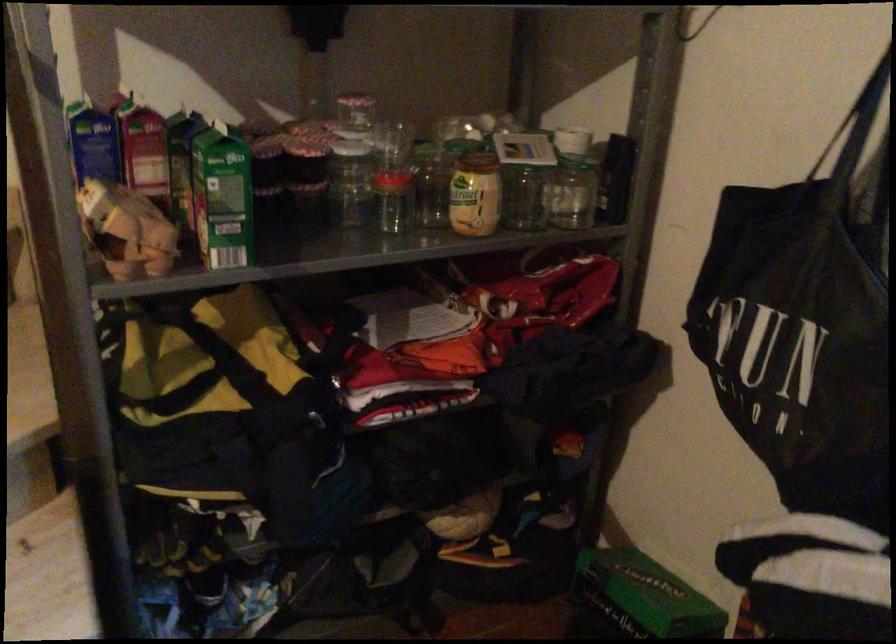
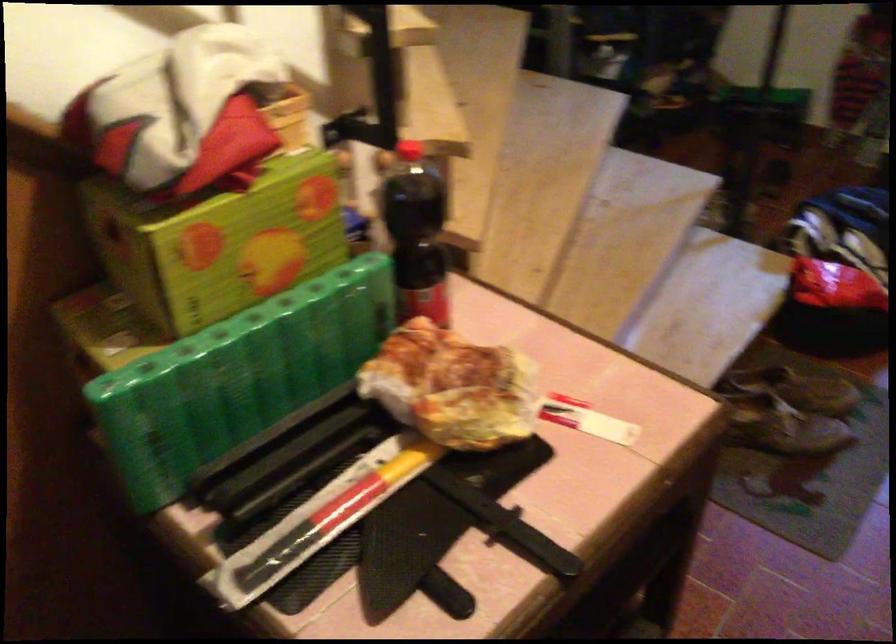
In a continuous first-person perspective shot, in which direction is the camera moving?

The cameraman moved toward left, backward.